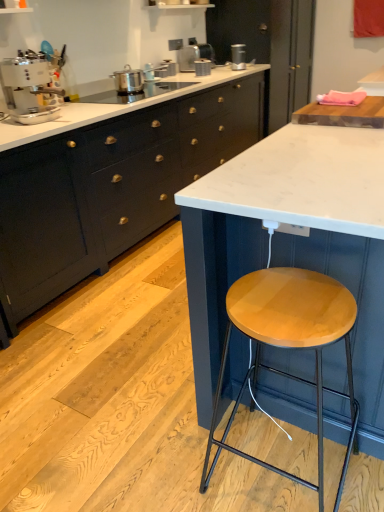
In order to click on blank space situated above wooden seat stool at center (from a real-world perspective) in this screenshot , I will do `click(290, 298)`.